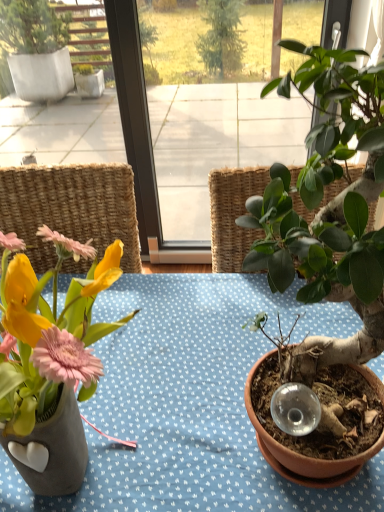
The height and width of the screenshot is (512, 384). I want to click on green matte plant at right, so pos(328,210).

What is the approximate height of green matte plant at right?

The height of green matte plant at right is 25.94 inches.

What is the approximate width of green matte plant at right?

It is 11.32 inches.

Describe the element at coordinates (328, 210) in the screenshot. I see `green matte plant at right` at that location.

What is the approximate height of matte ceramic vase at left?

matte ceramic vase at left is 17.22 inches tall.

Describe the element at coordinates (50, 330) in the screenshot. This screenshot has height=512, width=384. I see `matte ceramic vase at left` at that location.

Locate an element on the screen. Image resolution: width=384 pixels, height=512 pixels. matte ceramic vase at left is located at coordinates (50, 330).

Locate an element on the screen. This screenshot has height=512, width=384. green matte plant at right is located at coordinates (328, 210).

Which object is positioned more to the right, green matte plant at right or matte ceramic vase at left?

green matte plant at right.

From the picture: Between green matte plant at right and matte ceramic vase at left, which one is positioned in front?

Positioned in front is green matte plant at right.

Considering the positions of point (292, 472) and point (14, 416), is point (292, 472) closer or farther from the camera than point (14, 416)?

Point (292, 472) is farther from the camera than point (14, 416).

From the image's perspective, is green matte plant at right beneath matte ceramic vase at left?

No, from the image's perspective, green matte plant at right is not below matte ceramic vase at left.

From a real-world perspective, is green matte plant at right on matte ceramic vase at left?

Yes, from a real-world perspective, green matte plant at right is on top of matte ceramic vase at left.

Between green matte plant at right and matte ceramic vase at left, which one has smaller width?

Thinner between the two is green matte plant at right.

Is green matte plant at right shorter than matte ceramic vase at left?

No.

Considering the relative sizes of green matte plant at right and matte ceramic vase at left in the image provided, is green matte plant at right bigger than matte ceramic vase at left?

Correct, green matte plant at right is larger in size than matte ceramic vase at left.

Is green matte plant at right surrounding matte ceramic vase at left?

Actually, matte ceramic vase at left is outside green matte plant at right.

In the scene shown: Is green matte plant at right not near matte ceramic vase at left?

No, green matte plant at right is in close proximity to matte ceramic vase at left.

Is green matte plant at right facing away from matte ceramic vase at left?

No.

How much distance is there between green matte plant at right and matte ceramic vase at left?

They are 30.26 centimeters apart.

Identify the location of flower that appears below the green matte plant at right (from a real-world perspective). This screenshot has width=384, height=512. (50, 330).

Looking at this image, based on their positions, is matte ceramic vase at left located to the left or right of green matte plant at right?

Clearly, matte ceramic vase at left is on the left of green matte plant at right in the image.

Which is behind, matte ceramic vase at left or green matte plant at right?

matte ceramic vase at left.

Which is in front, point (14, 331) or point (316, 245)?

The point (316, 245) is closer.

From the image's perspective, is matte ceramic vase at left over green matte plant at right?

No, from the image's perspective, matte ceramic vase at left is not over green matte plant at right.

From a real-world perspective, which is physically above, matte ceramic vase at left or green matte plant at right?

green matte plant at right.

Is matte ceramic vase at left wider or thinner than green matte plant at right?

Clearly, matte ceramic vase at left has more width compared to green matte plant at right.

From the picture: Can you confirm if matte ceramic vase at left is shorter than green matte plant at right?

Correct, matte ceramic vase at left is not as tall as green matte plant at right.

Considering the relative sizes of matte ceramic vase at left and green matte plant at right in the image provided, is matte ceramic vase at left smaller than green matte plant at right?

Yes, matte ceramic vase at left is smaller than green matte plant at right.

Is matte ceramic vase at left completely or partially outside of green matte plant at right?

matte ceramic vase at left lies outside green matte plant at right's area.

Is matte ceramic vase at left directly adjacent to green matte plant at right?

They are not placed beside each other.

Is matte ceramic vase at left facing away from green matte plant at right?

matte ceramic vase at left is not turned away from green matte plant at right.

How much distance is there between matte ceramic vase at left and green matte plant at right?

matte ceramic vase at left is 30.26 centimeters from green matte plant at right.

At what (x,y) coordinates should I click in order to perform the action: click on houseplant above the matte ceramic vase at left (from a real-world perspective). Please return your answer as a coordinate pair (x, y). Looking at the image, I should click on (328, 210).

There is a matte ceramic vase at left. Identify the location of houseplant above it (from a real-world perspective). (328, 210).

You are a GUI agent. You are given a task and a screenshot of the screen. Output one action in this format:
    pyautogui.click(x=<x>, y=<y>)
    Task: Click on the flower that appears below the green matte plant at right (from the image's perspective)
    The image size is (384, 512).
    Given the screenshot: What is the action you would take?
    pyautogui.click(x=50, y=330)